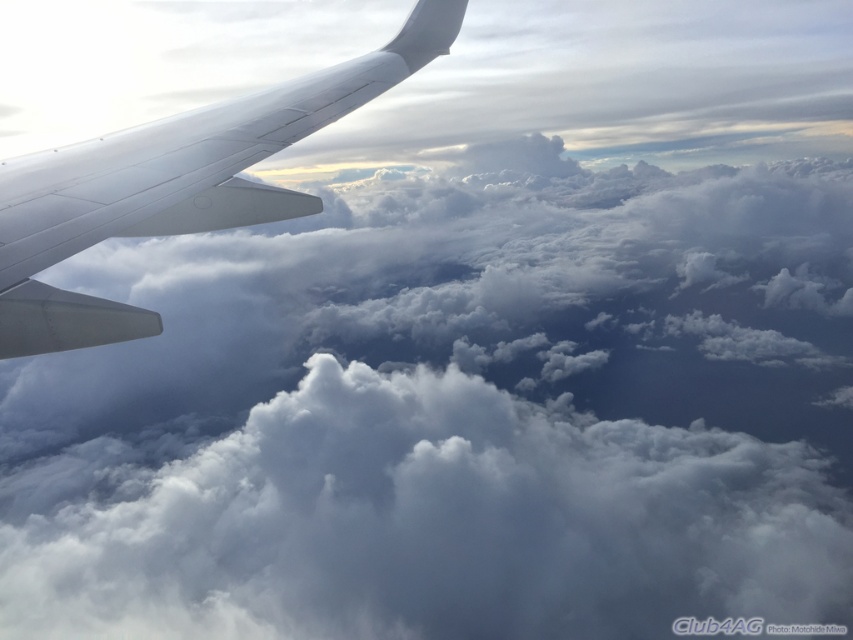
You are a pilot observing the clouds and the airplane wing from the cockpit. Which object is positioned higher in the sky between the white fluffy cloud at center and the white matte airplane wing at upper left?

The white fluffy cloud at center is below the white matte airplane wing at upper left, so the wing is higher in the sky.